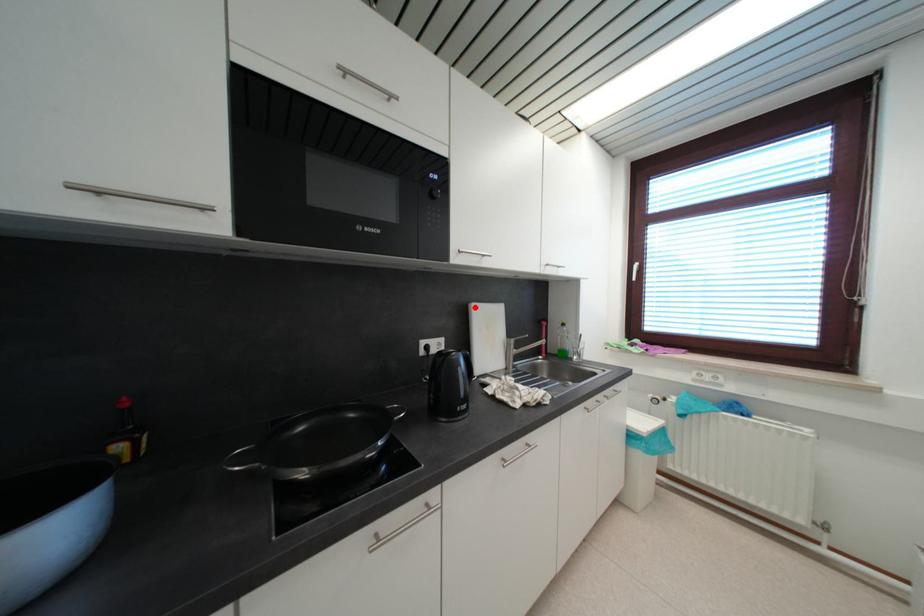
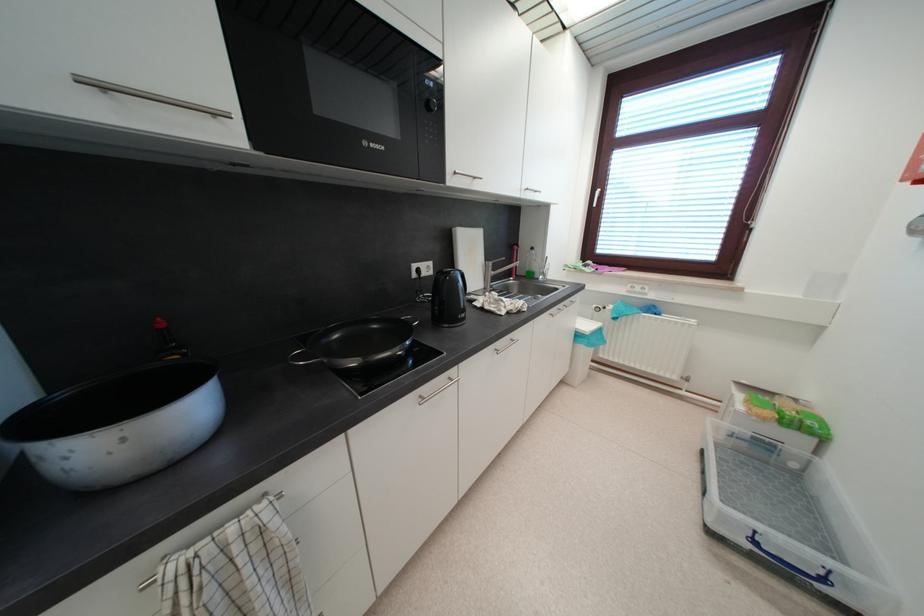
Locate, in the second image, the point that corresponds to the highlighted location in the first image.

(458, 232)